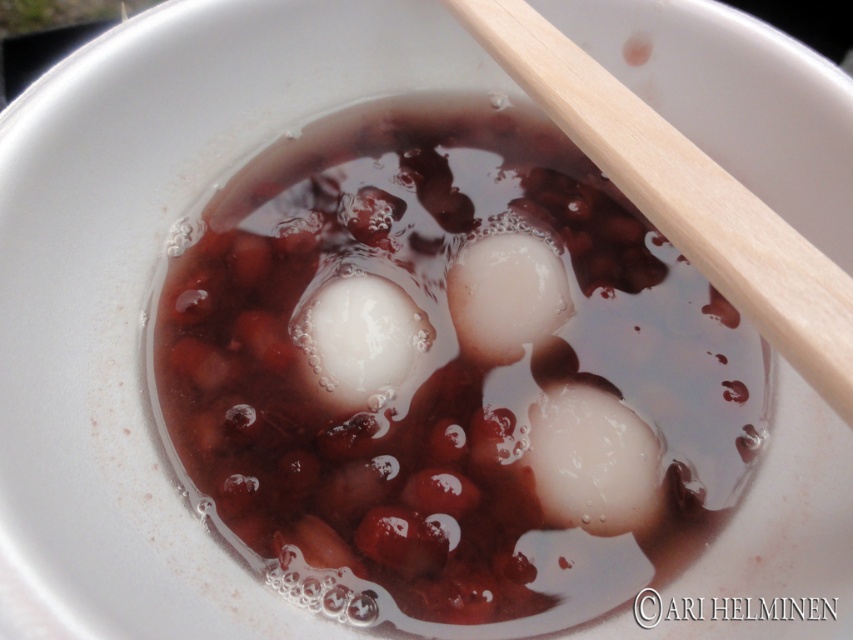
You are a chef preparing to serve this dessert. You need to place a spoon exactly halfway between the two points marked as point (553, 364). Where should you place the spoon?

The spoon should be placed exactly halfway between the two points marked as point (553, 364). Since they are 35.33 inches apart, the midpoint would be 17.665 inches from each point.

You are a dessert chef preparing a traditional sweet soup. You have a bowl with white glossy balls at center and a wooden at upper right. Which object in the bowl is larger?

The white glossy balls at center is bigger than wooden at upper right.